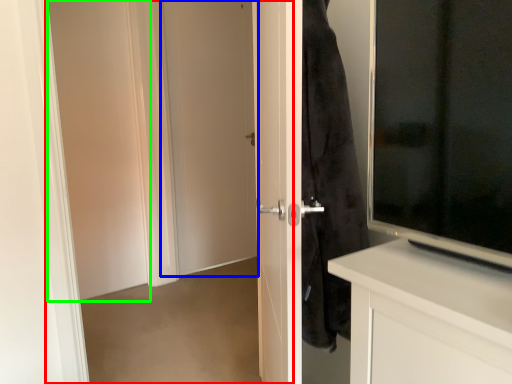
Question: Which object is the farthest from screen door (highlighted by a red box)? Choose among these: door (highlighted by a blue box) or screen door (highlighted by a green box).

Choices:
 (A) door
 (B) screen door

Answer: (B)